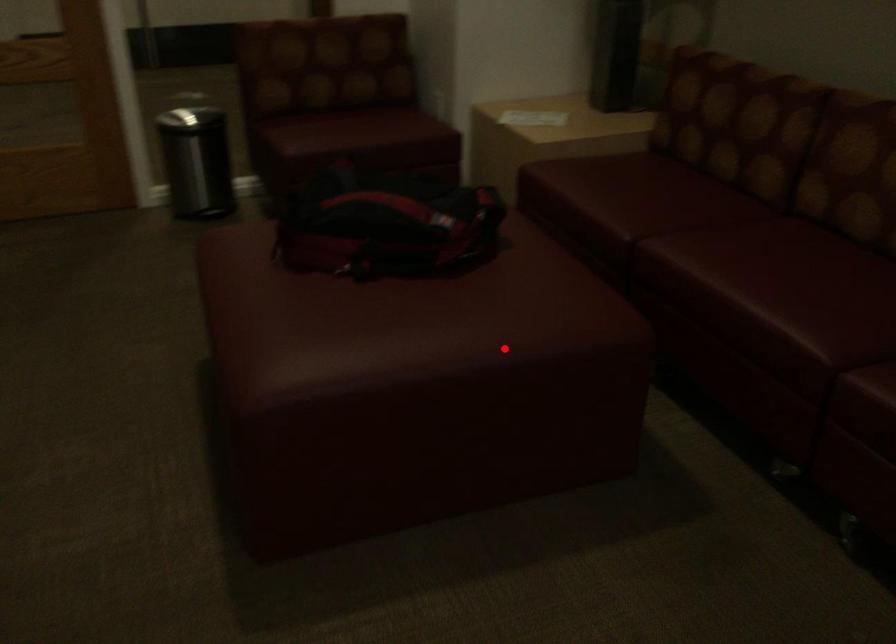
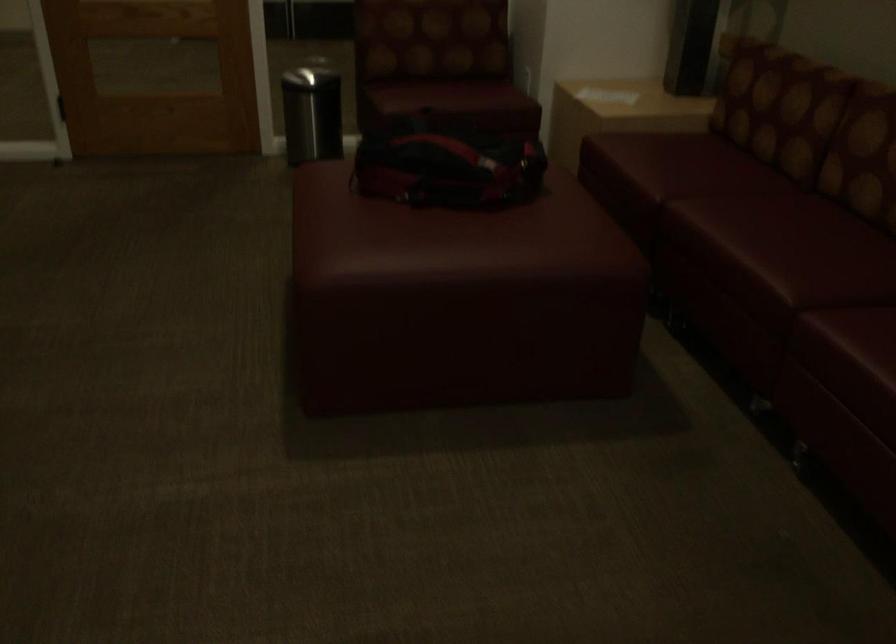
Question: I am providing you with two images of the same scene from different viewpoints. Given a red point in image1, look at the same physical point in image2. Is it:

Choices:
 (A) Closer to the viewpoint
 (B) Farther from the viewpoint

Answer: (B)